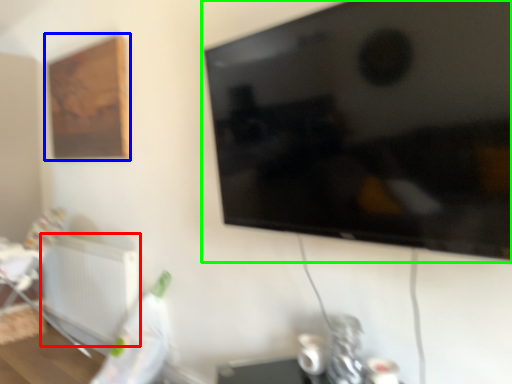
Question: Which object is the farthest from radiator (highlighted by a red box)? Choose among these: picture frame (highlighted by a blue box) or television (highlighted by a green box).

Choices:
 (A) picture frame
 (B) television

Answer: (B)